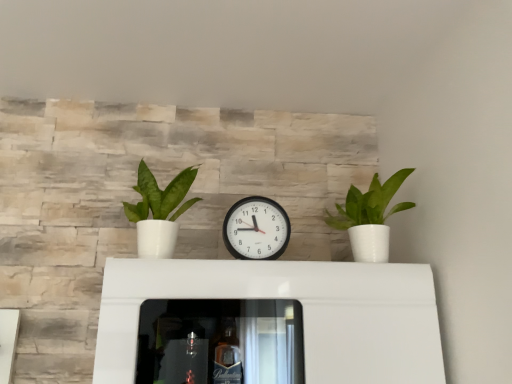
What do you see at coordinates (159, 211) in the screenshot? This screenshot has width=512, height=384. I see `green matte plant at left, arranged as the 1th houseplant when viewed from the left` at bounding box center [159, 211].

Locate an element on the screen. green matte plant at left, arranged as the 1th houseplant when viewed from the left is located at coordinates (159, 211).

At what (x,y) coordinates should I click in order to perform the action: click on black plastic wall clock at center. Please return your answer as a coordinate pair (x, y). Looking at the image, I should click on (256, 229).

The image size is (512, 384). Describe the element at coordinates (369, 217) in the screenshot. I see `white glossy pot at right, acting as the second houseplant starting from the left` at that location.

Measure the distance between white glossy pot at right, acting as the second houseplant starting from the left, and camera.

white glossy pot at right, acting as the second houseplant starting from the left, and camera are 3.62 feet apart.

Find the location of a particular element. green matte plant at left, arranged as the 1th houseplant when viewed from the left is located at coordinates (159, 211).

Would you say black plastic wall clock at center is a long distance from green matte plant at left, arranged as the 1th houseplant when viewed from the left?

No, there isn't a large distance between black plastic wall clock at center and green matte plant at left, arranged as the 1th houseplant when viewed from the left.

Is black plastic wall clock at center turned away from green matte plant at left, arranged as the 1th houseplant when viewed from the left?

No, black plastic wall clock at center's orientation is not away from green matte plant at left, arranged as the 1th houseplant when viewed from the left.

Does point (237, 208) appear closer or farther from the camera than point (168, 210)?

Point (237, 208) is farther from the camera than point (168, 210).

Is white glossy pot at right, the first houseplant when ordered from right to left, positioned before green matte plant at left, arranged as the 1th houseplant when viewed from the left?

No, white glossy pot at right, the first houseplant when ordered from right to left, is behind green matte plant at left, arranged as the 1th houseplant when viewed from the left.

Is green matte plant at left, arranged as the 1th houseplant when viewed from the left, at the back of white glossy pot at right, acting as the second houseplant starting from the left?

white glossy pot at right, acting as the second houseplant starting from the left, does not have its back to green matte plant at left, arranged as the 1th houseplant when viewed from the left.

Consider the image. From the image's perspective, who appears lower, white glossy pot at right, acting as the second houseplant starting from the left, or green matte plant at left, the 2th houseplant from the right?

white glossy pot at right, acting as the second houseplant starting from the left, appears lower in the image.

Is white glossy pot at right, the first houseplant when ordered from right to left, completely or partially outside of green matte plant at left, arranged as the 1th houseplant when viewed from the left?

Yes, white glossy pot at right, the first houseplant when ordered from right to left, is outside of green matte plant at left, arranged as the 1th houseplant when viewed from the left.

Starting from the black plastic wall clock at center, which houseplant is the 2nd one in front? Please provide its 2D coordinates.

[(159, 211)]

Between green matte plant at left, arranged as the 1th houseplant when viewed from the left, and black plastic wall clock at center, which one appears on the right side from the viewer's perspective?

black plastic wall clock at center.

Which is farther, (132,211) or (251,243)?

The point (132,211) is more distant.

Considering the sizes of objects green matte plant at left, the 2th houseplant from the right, and black plastic wall clock at center in the image provided, who is bigger, green matte plant at left, the 2th houseplant from the right, or black plastic wall clock at center?

green matte plant at left, the 2th houseplant from the right.

Which is more to the right, white glossy pot at right, acting as the second houseplant starting from the left, or black plastic wall clock at center?

white glossy pot at right, acting as the second houseplant starting from the left.

From the image's perspective, is white glossy pot at right, acting as the second houseplant starting from the left, located above or below black plastic wall clock at center?

Clearly, from the image's perspective, white glossy pot at right, acting as the second houseplant starting from the left, is above black plastic wall clock at center.

Which is in front, white glossy pot at right, acting as the second houseplant starting from the left, or black plastic wall clock at center?

white glossy pot at right, acting as the second houseplant starting from the left.

Considering the sizes of objects white glossy pot at right, the first houseplant when ordered from right to left, and black plastic wall clock at center in the image provided, who is taller, white glossy pot at right, the first houseplant when ordered from right to left, or black plastic wall clock at center?

Standing taller between the two is white glossy pot at right, the first houseplant when ordered from right to left.

From the picture: Which point is more forward, [161,218] or [370,201]?

The point [161,218] is in front.

Considering the sizes of objects green matte plant at left, arranged as the 1th houseplant when viewed from the left, and white glossy pot at right, acting as the second houseplant starting from the left, in the image provided, who is taller, green matte plant at left, arranged as the 1th houseplant when viewed from the left, or white glossy pot at right, acting as the second houseplant starting from the left,?

With more height is green matte plant at left, arranged as the 1th houseplant when viewed from the left.

Is green matte plant at left, the 2th houseplant from the right, wider or thinner than white glossy pot at right, the first houseplant when ordered from right to left?

In the image, green matte plant at left, the 2th houseplant from the right, appears to be wider than white glossy pot at right, the first houseplant when ordered from right to left.

How far apart are green matte plant at left, the 2th houseplant from the right, and white glossy pot at right, the first houseplant when ordered from right to left?

green matte plant at left, the 2th houseplant from the right, and white glossy pot at right, the first houseplant when ordered from right to left, are 47.54 centimeters apart from each other.

Is black plastic wall clock at center taller than white glossy pot at right, the first houseplant when ordered from right to left?

In fact, black plastic wall clock at center may be shorter than white glossy pot at right, the first houseplant when ordered from right to left.

From the picture: Is black plastic wall clock at center aimed at white glossy pot at right, acting as the second houseplant starting from the left?

No, black plastic wall clock at center is not facing towards white glossy pot at right, acting as the second houseplant starting from the left.

From the image's perspective, who appears lower, black plastic wall clock at center or white glossy pot at right, acting as the second houseplant starting from the left?

black plastic wall clock at center.

At what (x,y) coordinates should I click in order to perform the action: click on wall clock below the green matte plant at left, the 2th houseplant from the right (from a real-world perspective). Please return your answer as a coordinate pair (x, y). This screenshot has height=384, width=512. Looking at the image, I should click on (256, 229).

In the image, there is a green matte plant at left, arranged as the 1th houseplant when viewed from the left. Where is `houseplant below it (from the image's perspective)`? The height and width of the screenshot is (384, 512). houseplant below it (from the image's perspective) is located at coordinates (369, 217).

Based on their spatial positions, is green matte plant at left, the 2th houseplant from the right, or black plastic wall clock at center closer to white glossy pot at right, the first houseplant when ordered from right to left?

black plastic wall clock at center.

Looking at the image, which one is located further to black plastic wall clock at center, green matte plant at left, the 2th houseplant from the right, or white glossy pot at right, acting as the second houseplant starting from the left?

white glossy pot at right, acting as the second houseplant starting from the left, lies further to black plastic wall clock at center than the other object.

When comparing their distances from white glossy pot at right, the first houseplant when ordered from right to left, does black plastic wall clock at center or green matte plant at left, arranged as the 1th houseplant when viewed from the left, seem closer?

black plastic wall clock at center is closer to white glossy pot at right, the first houseplant when ordered from right to left.

Looking at the image, which one is located closer to green matte plant at left, arranged as the 1th houseplant when viewed from the left, white glossy pot at right, acting as the second houseplant starting from the left, or black plastic wall clock at center?

black plastic wall clock at center.

Looking at this image, based on their spatial positions, is white glossy pot at right, the first houseplant when ordered from right to left, or green matte plant at left, the 2th houseplant from the right, further from black plastic wall clock at center?

The object further to black plastic wall clock at center is white glossy pot at right, the first houseplant when ordered from right to left.

Estimate the real-world distances between objects in this image. Which object is closer to green matte plant at left, the 2th houseplant from the right, black plastic wall clock at center or white glossy pot at right, the first houseplant when ordered from right to left?

The object closer to green matte plant at left, the 2th houseplant from the right, is black plastic wall clock at center.

At what (x,y) coordinates should I click in order to perform the action: click on wall clock between green matte plant at left, arranged as the 1th houseplant when viewed from the left, and white glossy pot at right, the first houseplant when ordered from right to left. Please return your answer as a coordinate pair (x, y). This screenshot has width=512, height=384. Looking at the image, I should click on (256, 229).